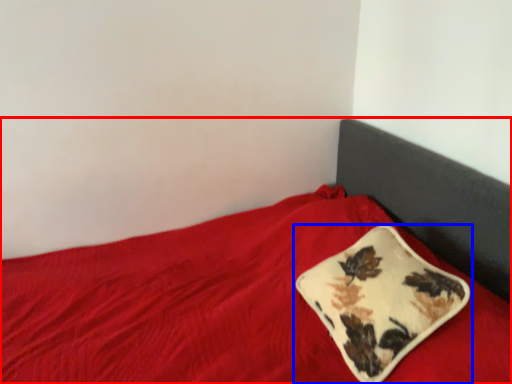
Question: Among these objects, which one is farthest to the camera, bed (highlighted by a red box) or pillow (highlighted by a blue box)?

Choices:
 (A) bed
 (B) pillow

Answer: (B)